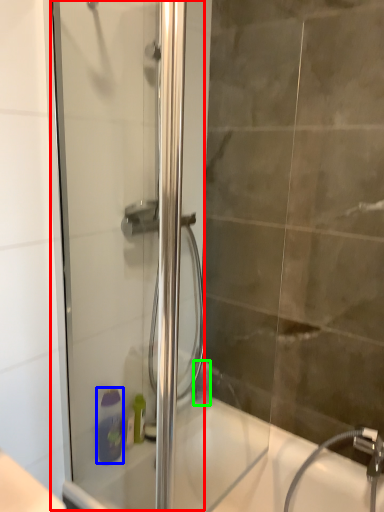
Question: Which object is the closest to the screen door (highlighted by a red box)? Choose among these: soap dispenser (highlighted by a blue box) or toiletry (highlighted by a green box).

Choices:
 (A) soap dispenser
 (B) toiletry

Answer: (A)